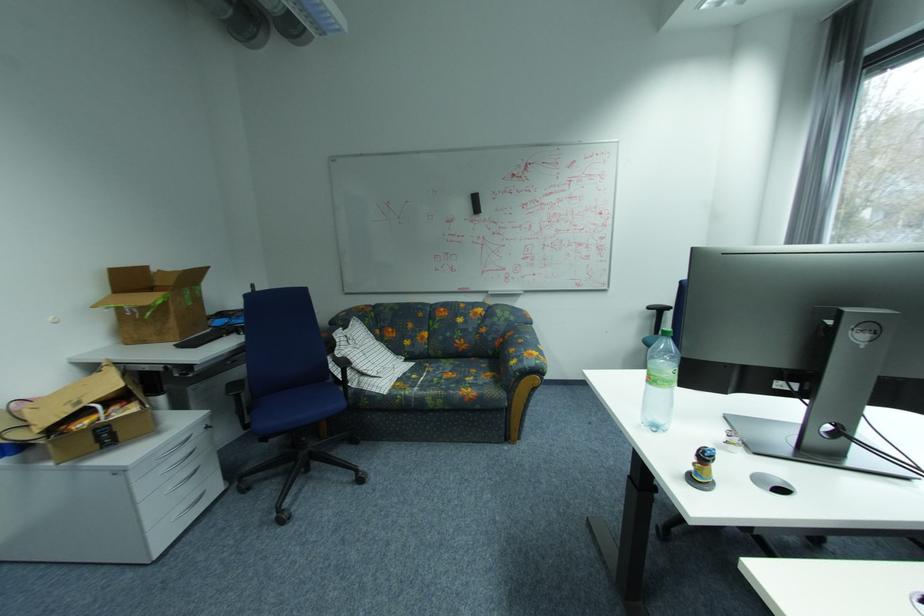
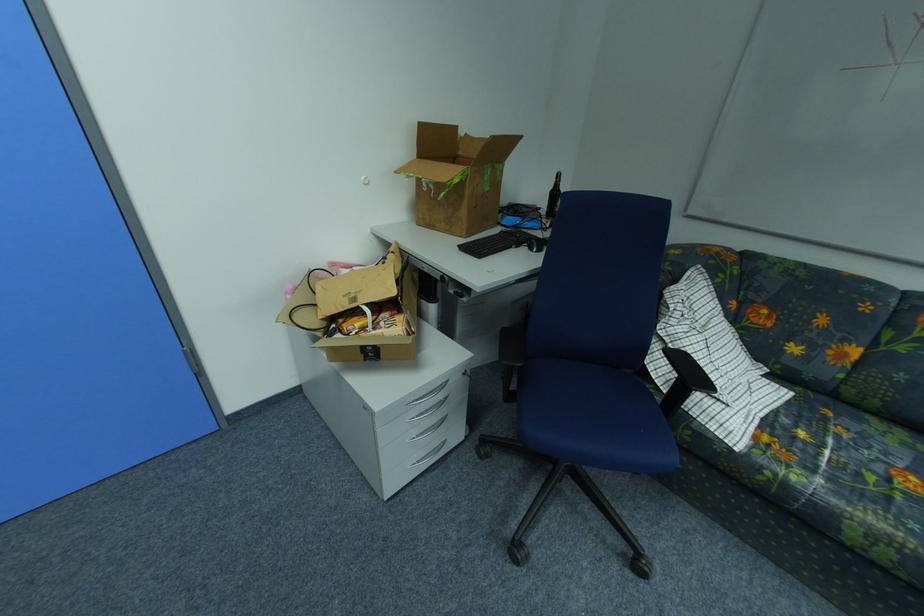
The point at (180, 323) is marked in the first image. Where is the corresponding point in the second image?

(470, 214)